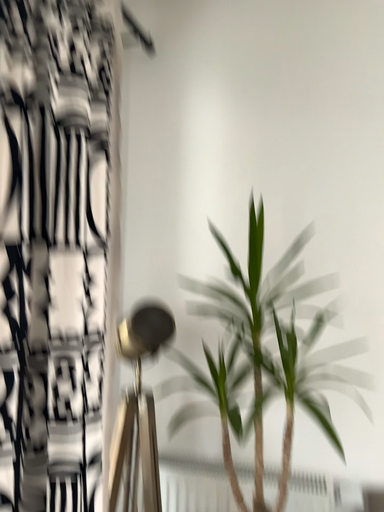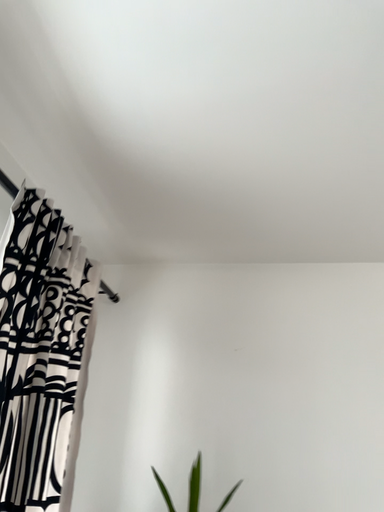
Question: How did the camera likely rotate when shooting the video?

Choices:
 (A) rotated upward
 (B) rotated downward

Answer: (A)